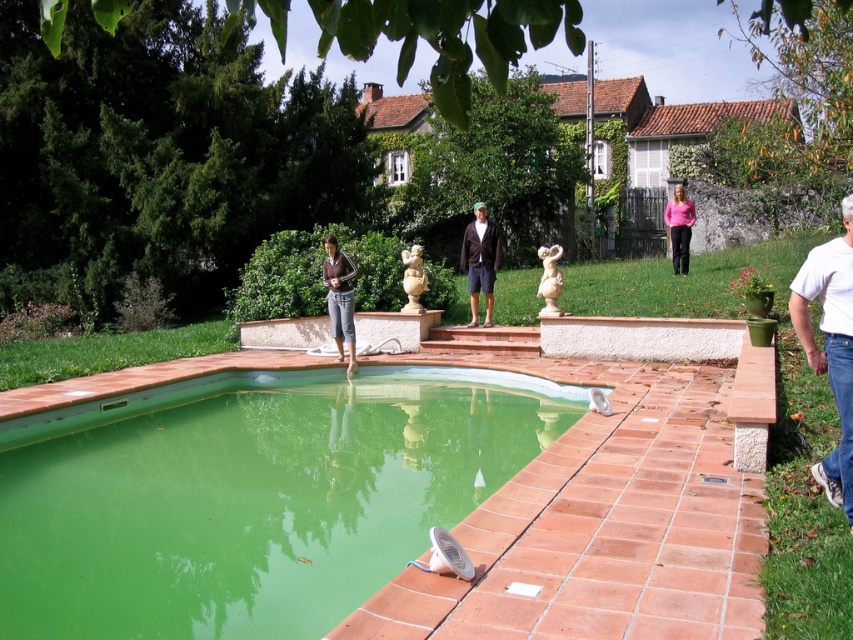
Question: Which point is farther to the camera?

Choices:
 (A) [349, 358]
 (B) [556, 285]
 (C) [471, 323]

Answer: (C)

Question: Can you confirm if white cotton shirt at right is positioned to the right of pink fabric shirt at upper right?

Choices:
 (A) no
 (B) yes

Answer: (A)

Question: Which object is farther from the camera taking this photo?

Choices:
 (A) green concrete pool at lower left
 (B) matte brown sweater at center
 (C) white marble statue at center

Answer: (C)

Question: Is matte brown sweater at center to the right of white marble statue at center from the viewer's perspective?

Choices:
 (A) no
 (B) yes

Answer: (A)

Question: Does green concrete pool at lower left appear over white cotton shirt at right?

Choices:
 (A) no
 (B) yes

Answer: (A)

Question: Which of the following is the farthest from the observer?

Choices:
 (A) (465, 260)
 (B) (329, 401)
 (C) (683, 212)
 (D) (830, 374)

Answer: (C)